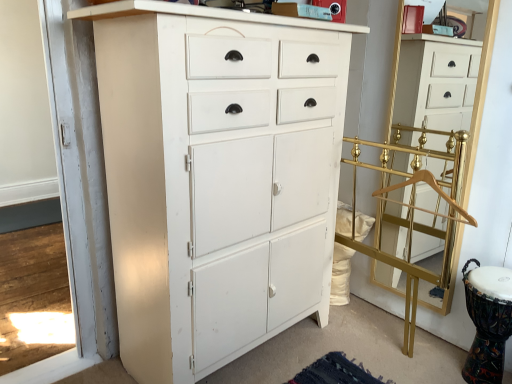
Image resolution: width=512 pixels, height=384 pixels. What do you see at coordinates (217, 177) in the screenshot?
I see `white painted wood cabinet at center, marked as the second chest of drawers in a right-to-left arrangement` at bounding box center [217, 177].

This screenshot has height=384, width=512. Describe the element at coordinates (436, 82) in the screenshot. I see `gold metallic coat rack at right, which is counted as the 2th chest of drawers, starting from the left` at that location.

At what (x,y) coordinates should I click in order to perform the action: click on white painted wood cabinet at center, acting as the first chest of drawers starting from the left. Please return your answer as a coordinate pair (x, y). The image size is (512, 384). Looking at the image, I should click on (217, 177).

Does gold wooden hanger at right have a larger size compared to white painted wood cabinet at center, acting as the first chest of drawers starting from the left?

No.

From the image's perspective, is gold wooden hanger at right above or below white painted wood cabinet at center, acting as the first chest of drawers starting from the left?

→ Based on their image positions, gold wooden hanger at right is located above white painted wood cabinet at center, acting as the first chest of drawers starting from the left.

Does gold wooden hanger at right have a greater height compared to white painted wood cabinet at center, marked as the second chest of drawers in a right-to-left arrangement?

No.

From a real-world perspective, between gold wooden hanger at right and white painted wood cabinet at center, marked as the second chest of drawers in a right-to-left arrangement, who is vertically higher?

gold wooden hanger at right, from a real-world perspective.

From the image's perspective, is white painted wood cabinet at center, acting as the first chest of drawers starting from the left, located above or below gold metallic coat rack at right?

Clearly, from the image's perspective, white painted wood cabinet at center, acting as the first chest of drawers starting from the left, is above gold metallic coat rack at right.

Could you measure the distance between white painted wood cabinet at center, marked as the second chest of drawers in a right-to-left arrangement, and gold metallic coat rack at right?

white painted wood cabinet at center, marked as the second chest of drawers in a right-to-left arrangement, is 66.92 centimeters from gold metallic coat rack at right.

In the scene shown: Can you see white painted wood cabinet at center, acting as the first chest of drawers starting from the left, touching gold metallic coat rack at right?

No, white painted wood cabinet at center, acting as the first chest of drawers starting from the left, is not making contact with gold metallic coat rack at right.

Can you confirm if gold metallic coat rack at right is bigger than gold metallic coat rack at right, which is counted as the 2th chest of drawers, starting from the left?

Indeed, gold metallic coat rack at right has a larger size compared to gold metallic coat rack at right, which is counted as the 2th chest of drawers, starting from the left.

Who is shorter, gold metallic coat rack at right or gold metallic coat rack at right, which is counted as the 2th chest of drawers, starting from the left?

Standing shorter between the two is gold metallic coat rack at right.

In the scene shown: Are gold metallic coat rack at right and gold metallic coat rack at right, placed as the 1th chest of drawers when sorted from right to left, beside each other?

No.

In the scene shown: Is the position of gold metallic coat rack at right more distant than that of gold metallic coat rack at right, which is counted as the 2th chest of drawers, starting from the left?

No, gold metallic coat rack at right is closer to the viewer.

Is white painted wood cabinet at center, acting as the first chest of drawers starting from the left, spatially inside gold metallic coat rack at right, placed as the 1th chest of drawers when sorted from right to left, or outside of it?

white painted wood cabinet at center, acting as the first chest of drawers starting from the left, lies outside gold metallic coat rack at right, placed as the 1th chest of drawers when sorted from right to left.

Considering the positions of objects white painted wood cabinet at center, marked as the second chest of drawers in a right-to-left arrangement, and gold metallic coat rack at right, which is counted as the 2th chest of drawers, starting from the left, in the image provided, who is more to the right, white painted wood cabinet at center, marked as the second chest of drawers in a right-to-left arrangement, or gold metallic coat rack at right, which is counted as the 2th chest of drawers, starting from the left,?

gold metallic coat rack at right, which is counted as the 2th chest of drawers, starting from the left, is more to the right.

Considering the points (248, 195) and (418, 132), which point is behind, point (248, 195) or point (418, 132)?

Positioned behind is point (418, 132).

Considering the positions of objects gold metallic coat rack at right, which is counted as the 2th chest of drawers, starting from the left, and gold metallic coat rack at right in the image provided, who is more to the right, gold metallic coat rack at right, which is counted as the 2th chest of drawers, starting from the left, or gold metallic coat rack at right?

gold metallic coat rack at right, which is counted as the 2th chest of drawers, starting from the left, is more to the right.

Between gold metallic coat rack at right, placed as the 1th chest of drawers when sorted from right to left, and gold metallic coat rack at right, which one has more height?

With more height is gold metallic coat rack at right, placed as the 1th chest of drawers when sorted from right to left.

Is gold metallic coat rack at right a part of gold metallic coat rack at right, placed as the 1th chest of drawers when sorted from right to left?

No, gold metallic coat rack at right is not surrounded by gold metallic coat rack at right, placed as the 1th chest of drawers when sorted from right to left.

Is point (460, 86) closer or farther from the camera than point (452, 161)?

Clearly, point (460, 86) is closer to the camera than point (452, 161).

Who is smaller, gold metallic coat rack at right, which is counted as the 2th chest of drawers, starting from the left, or gold wooden hanger at right?

gold wooden hanger at right.

In the scene shown: Is gold metallic coat rack at right, which is counted as the 2th chest of drawers, starting from the left, turned away from gold wooden hanger at right?

gold metallic coat rack at right, which is counted as the 2th chest of drawers, starting from the left, is not turned away from gold wooden hanger at right.

Considering the relative sizes of gold wooden hanger at right and gold metallic coat rack at right, placed as the 1th chest of drawers when sorted from right to left, in the image provided, is gold wooden hanger at right smaller than gold metallic coat rack at right, placed as the 1th chest of drawers when sorted from right to left,?

Indeed, gold wooden hanger at right has a smaller size compared to gold metallic coat rack at right, placed as the 1th chest of drawers when sorted from right to left.

Could you tell me if gold wooden hanger at right is turned towards gold metallic coat rack at right, which is counted as the 2th chest of drawers, starting from the left?

No.

Is gold wooden hanger at right not near gold metallic coat rack at right, placed as the 1th chest of drawers when sorted from right to left?

No, gold wooden hanger at right is not far away from gold metallic coat rack at right, placed as the 1th chest of drawers when sorted from right to left.

From a real-world perspective, is gold wooden hanger at right positioned above or below gold metallic coat rack at right, placed as the 1th chest of drawers when sorted from right to left?

Clearly, from a real-world perspective, gold wooden hanger at right is below gold metallic coat rack at right, placed as the 1th chest of drawers when sorted from right to left.

Find the location of `hanger that appears above the white painted wood cabinet at center, acting as the first chest of drawers starting from the left (from a real-world perspective)`. hanger that appears above the white painted wood cabinet at center, acting as the first chest of drawers starting from the left (from a real-world perspective) is located at coordinates [434, 190].

You are a GUI agent. You are given a task and a screenshot of the screen. Output one action in this format:
    pyautogui.click(x=<x>, y=<y>)
    Task: Click on the bunk bed located behind the white painted wood cabinet at center, marked as the second chest of drawers in a right-to-left arrangement
    
    Given the screenshot: What is the action you would take?
    pyautogui.click(x=413, y=211)

Based on their spatial positions, is gold metallic coat rack at right, which is counted as the 2th chest of drawers, starting from the left, or gold metallic coat rack at right closer to gold wooden hanger at right?

gold metallic coat rack at right is closer to gold wooden hanger at right.

Looking at the image, which one is located further to white painted wood cabinet at center, marked as the second chest of drawers in a right-to-left arrangement, gold metallic coat rack at right, placed as the 1th chest of drawers when sorted from right to left, or gold wooden hanger at right?

gold metallic coat rack at right, placed as the 1th chest of drawers when sorted from right to left.

Based on their spatial positions, is white painted wood cabinet at center, marked as the second chest of drawers in a right-to-left arrangement, or gold metallic coat rack at right, placed as the 1th chest of drawers when sorted from right to left, closer to gold wooden hanger at right?

The object closer to gold wooden hanger at right is gold metallic coat rack at right, placed as the 1th chest of drawers when sorted from right to left.

When comparing their distances from gold wooden hanger at right, does gold metallic coat rack at right or white painted wood cabinet at center, marked as the second chest of drawers in a right-to-left arrangement, seem closer?

gold metallic coat rack at right lies closer to gold wooden hanger at right than the other object.

From the image, which object appears to be farther from gold metallic coat rack at right, placed as the 1th chest of drawers when sorted from right to left, gold metallic coat rack at right or white painted wood cabinet at center, acting as the first chest of drawers starting from the left?

Among the two, white painted wood cabinet at center, acting as the first chest of drawers starting from the left, is located further to gold metallic coat rack at right, placed as the 1th chest of drawers when sorted from right to left.

When comparing their distances from gold metallic coat rack at right, placed as the 1th chest of drawers when sorted from right to left, does gold wooden hanger at right or white painted wood cabinet at center, acting as the first chest of drawers starting from the left, seem closer?

Based on the image, gold wooden hanger at right appears to be nearer to gold metallic coat rack at right, placed as the 1th chest of drawers when sorted from right to left.

From the picture: Which object lies nearer to the anchor point gold metallic coat rack at right, gold metallic coat rack at right, placed as the 1th chest of drawers when sorted from right to left, or white painted wood cabinet at center, acting as the first chest of drawers starting from the left?

gold metallic coat rack at right, placed as the 1th chest of drawers when sorted from right to left, is closer to gold metallic coat rack at right.

Estimate the real-world distances between objects in this image. Which object is closer to gold wooden hanger at right, gold metallic coat rack at right or gold metallic coat rack at right, placed as the 1th chest of drawers when sorted from right to left?

gold metallic coat rack at right lies closer to gold wooden hanger at right than the other object.

Image resolution: width=512 pixels, height=384 pixels. Identify the location of hanger between gold metallic coat rack at right, which is counted as the 2th chest of drawers, starting from the left, and gold metallic coat rack at right vertically. (434, 190).

What are the coordinates of `hanger between white painted wood cabinet at center, marked as the second chest of drawers in a right-to-left arrangement, and gold metallic coat rack at right, which is counted as the 2th chest of drawers, starting from the left` in the screenshot? It's located at (434, 190).

Locate an element on the screen. This screenshot has width=512, height=384. bunk bed situated between white painted wood cabinet at center, acting as the first chest of drawers starting from the left, and gold wooden hanger at right from left to right is located at coordinates (413, 211).

Image resolution: width=512 pixels, height=384 pixels. I want to click on bunk bed located between white painted wood cabinet at center, marked as the second chest of drawers in a right-to-left arrangement, and gold metallic coat rack at right, which is counted as the 2th chest of drawers, starting from the left, in the left-right direction, so click(413, 211).